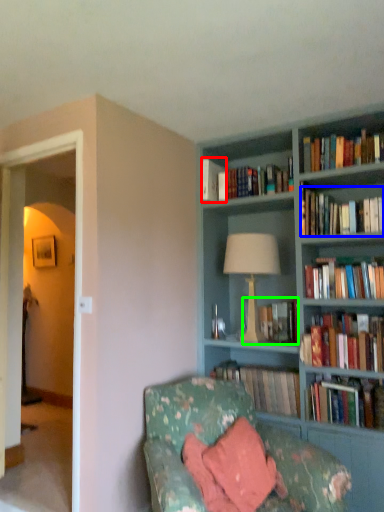
Question: Considering the real-world distances, which object is farthest from book (highlighted by a red box)? book (highlighted by a blue box) or book (highlighted by a green box)?

Choices:
 (A) book
 (B) book

Answer: (B)